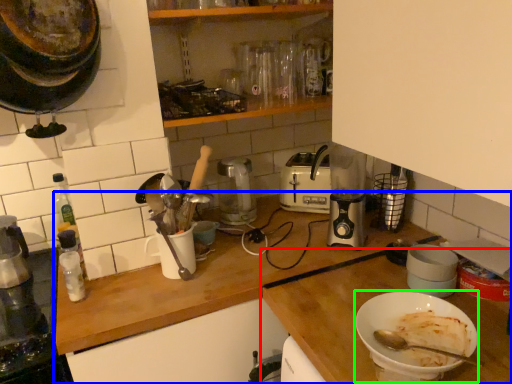
Question: Estimate the real-world distances between objects in this image. Which object is farther from countertop (highlighted by a red box), countertop (highlighted by a blue box) or bowl (highlighted by a green box)?

Choices:
 (A) countertop
 (B) bowl

Answer: (B)